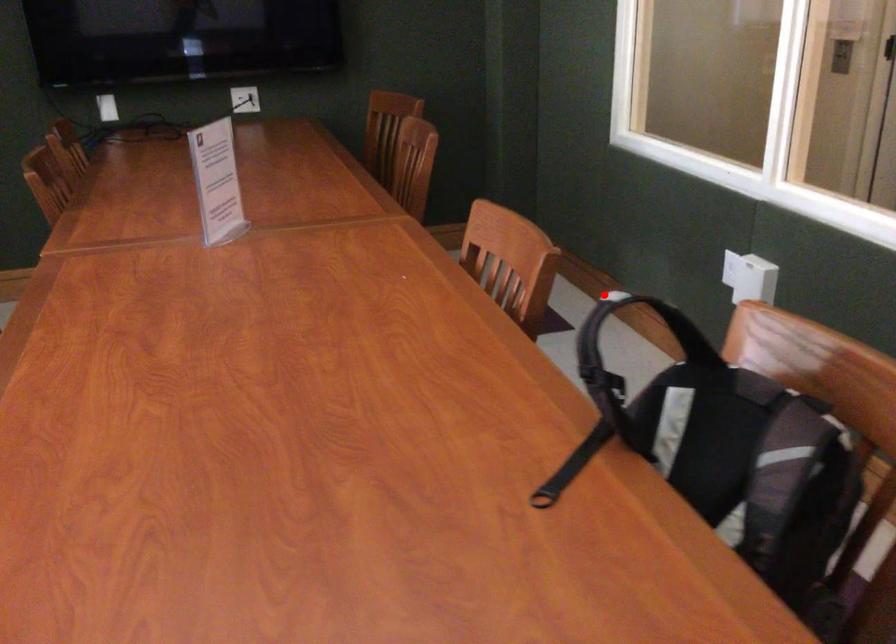
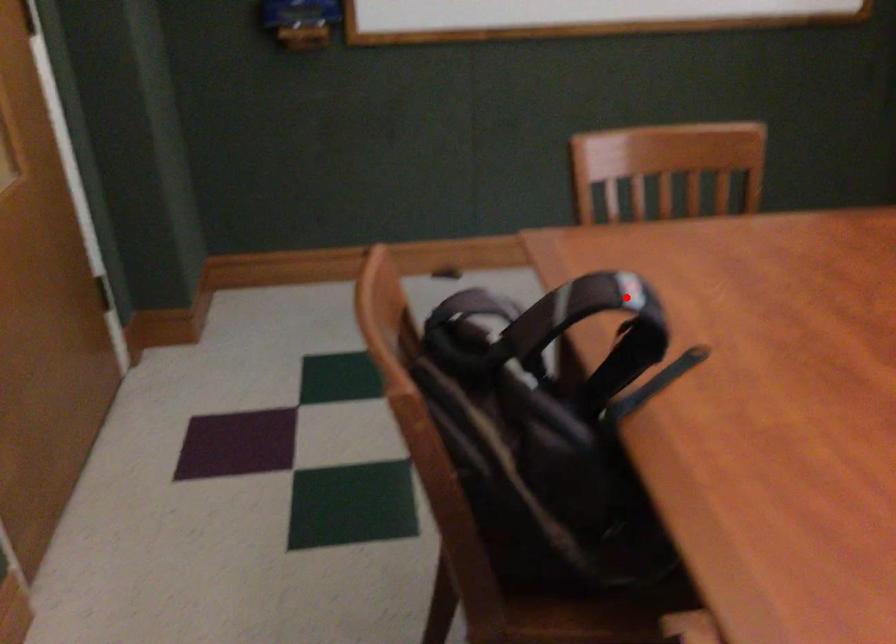
I am providing you with two images of the same scene from different viewpoints. A red point is marked on the first image and another point is marked on the second image. Do the highlighted points in image1 and image2 indicate the same real-world spot?

Yes